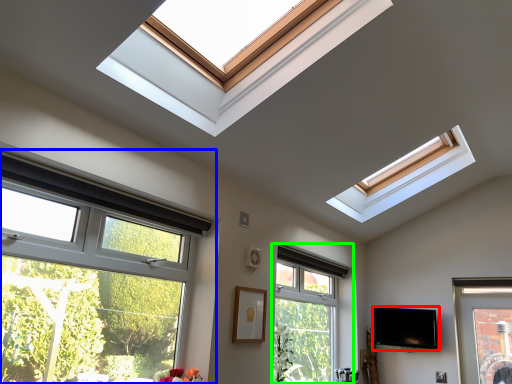
Question: Which object is the farthest from television (highlighted by a red box)? Choose among these: window (highlighted by a blue box) or window (highlighted by a green box).

Choices:
 (A) window
 (B) window

Answer: (A)